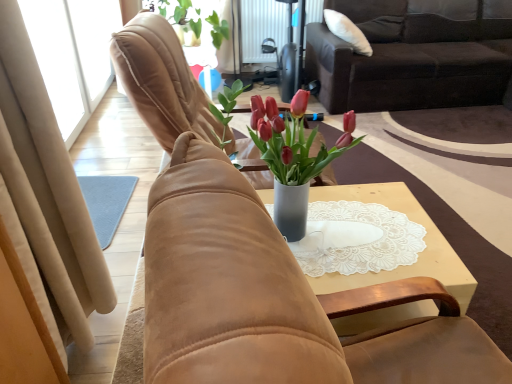
Question: Does suede chair at center, the 1th chair in the back-to-front sequence, have a smaller size compared to dark brown fabric couch at upper right?

Choices:
 (A) yes
 (B) no

Answer: (A)

Question: Considering the relative sizes of suede chair at center, which is the 2th chair from front to back, and dark brown fabric couch at upper right in the image provided, is suede chair at center, which is the 2th chair from front to back, wider than dark brown fabric couch at upper right?

Choices:
 (A) yes
 (B) no

Answer: (B)

Question: From a real-world perspective, is suede chair at center, which is the 2th chair from front to back, physically below dark brown fabric couch at upper right?

Choices:
 (A) no
 (B) yes

Answer: (A)

Question: Is suede chair at center, the 1th chair in the back-to-front sequence, looking in the opposite direction of dark brown fabric couch at upper right?

Choices:
 (A) yes
 (B) no

Answer: (B)

Question: Is suede chair at center, which is the 2th chair from front to back, surrounding dark brown fabric couch at upper right?

Choices:
 (A) no
 (B) yes

Answer: (A)

Question: Based on their positions, is green matte plant at upper center located to the left or right of beige suede curtain at left?

Choices:
 (A) left
 (B) right

Answer: (B)

Question: From their relative heights in the image, would you say green matte plant at upper center is taller or shorter than beige suede curtain at left?

Choices:
 (A) tall
 (B) short

Answer: (B)

Question: Is green matte plant at upper center bigger or smaller than beige suede curtain at left?

Choices:
 (A) small
 (B) big

Answer: (A)

Question: From the image's perspective, is green matte plant at upper center above or below beige suede curtain at left?

Choices:
 (A) below
 (B) above

Answer: (B)

Question: From the image's perspective, relative to metallic radiator at upper center, is suede chair at center, the 2th chair positioned from the back, above or below?

Choices:
 (A) above
 (B) below

Answer: (B)

Question: From a real-world perspective, relative to metallic radiator at upper center, is suede chair at center, the 2th chair positioned from the back, vertically above or below?

Choices:
 (A) above
 (B) below

Answer: (A)

Question: Is suede chair at center, the 2th chair positioned from the back, to the left or to the right of metallic radiator at upper center in the image?

Choices:
 (A) left
 (B) right

Answer: (B)

Question: Is suede chair at center, positioned as the 1th chair in front-to-back order, situated inside metallic radiator at upper center or outside?

Choices:
 (A) inside
 (B) outside

Answer: (B)

Question: Relative to white lace doily at center, is metallic radiator at upper center in front or behind?

Choices:
 (A) behind
 (B) front

Answer: (A)

Question: From a real-world perspective, is metallic radiator at upper center positioned above or below white lace doily at center?

Choices:
 (A) below
 (B) above

Answer: (B)